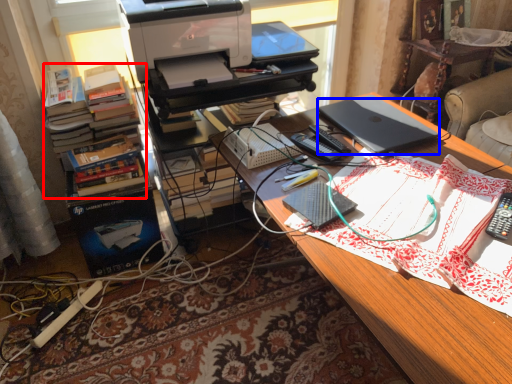
Question: Which object appears farthest to the camera in this image, book (highlighted by a red box) or laptop (highlighted by a blue box)?

Choices:
 (A) book
 (B) laptop

Answer: (A)